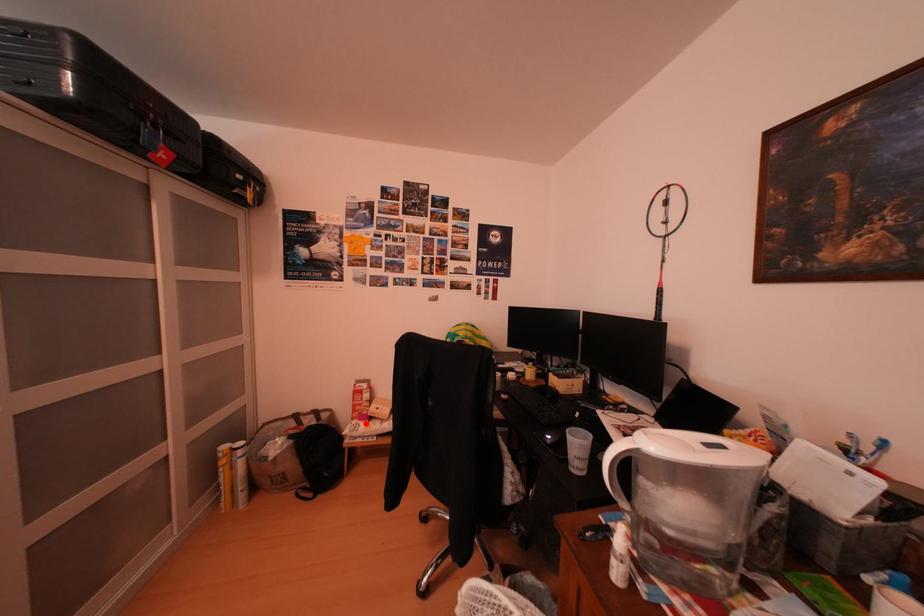
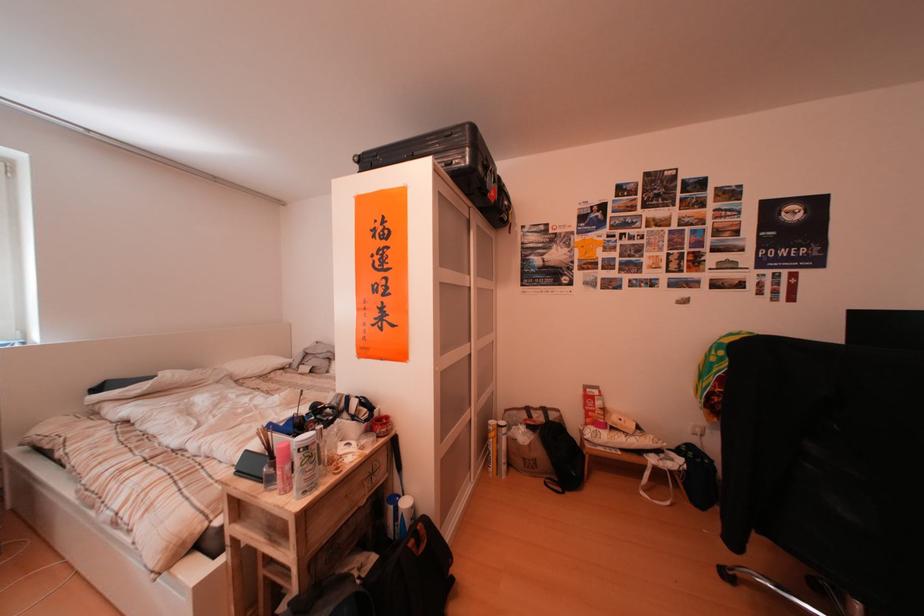
Question: I am providing you with two images of the same scene from different viewpoints. A red point is shown in image1. For the corresponding object point in image2, is it positioned nearer or farther from the camera?

Choices:
 (A) Nearer
 (B) Farther

Answer: (B)